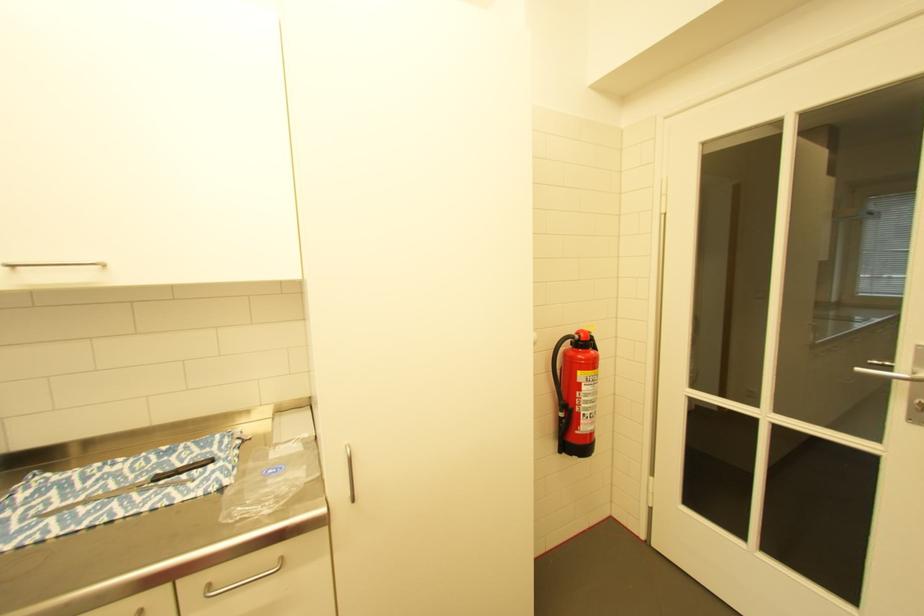
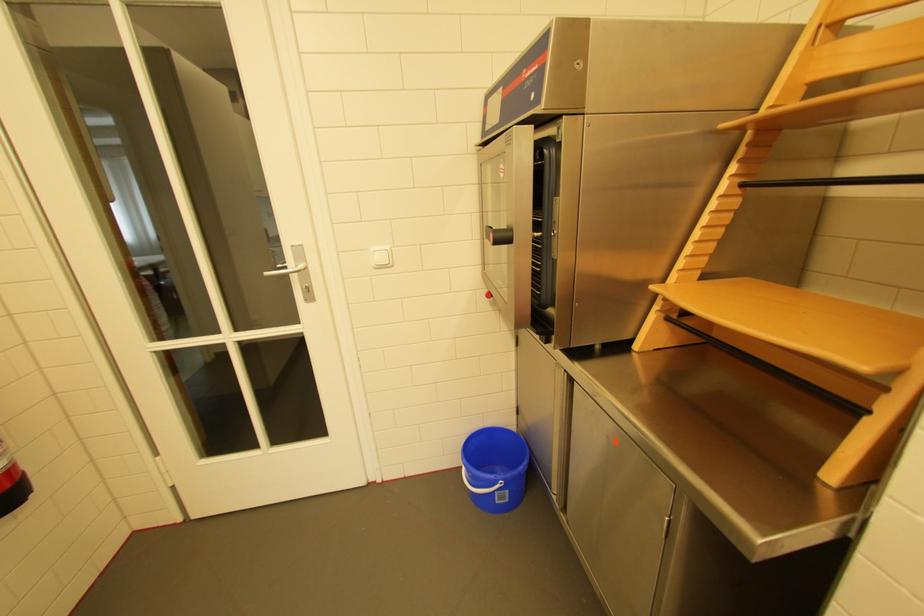
The point at (867, 370) is marked in the first image. Where is the corresponding point in the second image?

(274, 274)